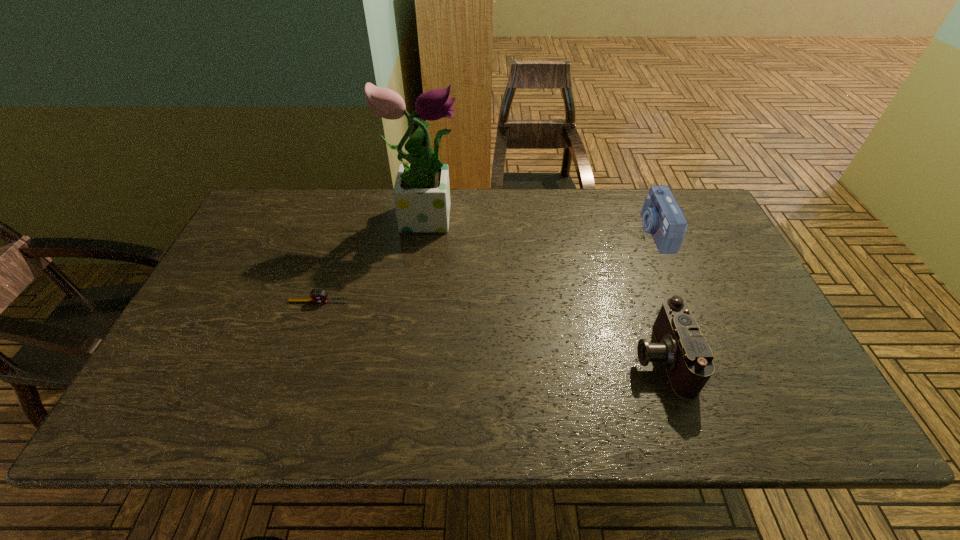
Where is `vacant space in between the rightmost object and the nearer camera`? This screenshot has height=540, width=960. vacant space in between the rightmost object and the nearer camera is located at coordinates (658, 295).

What are the coordinates of `free space between the tallest object and the rightmost object` in the screenshot? It's located at (540, 224).

The width and height of the screenshot is (960, 540). I want to click on free space that is in between the tape measure and the tallest object, so click(372, 258).

Where is `blank region between the tallest object and the second nearest object`? blank region between the tallest object and the second nearest object is located at coordinates (372, 258).

Where is `free space between the leftmost object and the farther camera`? free space between the leftmost object and the farther camera is located at coordinates (487, 267).

Where is `vacant space that is in between the second nearest object and the nearest object`? The height and width of the screenshot is (540, 960). vacant space that is in between the second nearest object and the nearest object is located at coordinates (490, 329).

You are a GUI agent. You are given a task and a screenshot of the screen. Output one action in this format:
    pyautogui.click(x=<x>, y=<y>)
    Task: Click on the free space that is in between the left camera and the flower arrangement
    The width and height of the screenshot is (960, 540).
    Given the screenshot: What is the action you would take?
    pyautogui.click(x=542, y=286)

I want to click on the second closest object to the tallest object, so click(x=686, y=354).

Image resolution: width=960 pixels, height=540 pixels. What are the coordinates of `the second closest object to the leftmost object` in the screenshot? It's located at (686, 354).